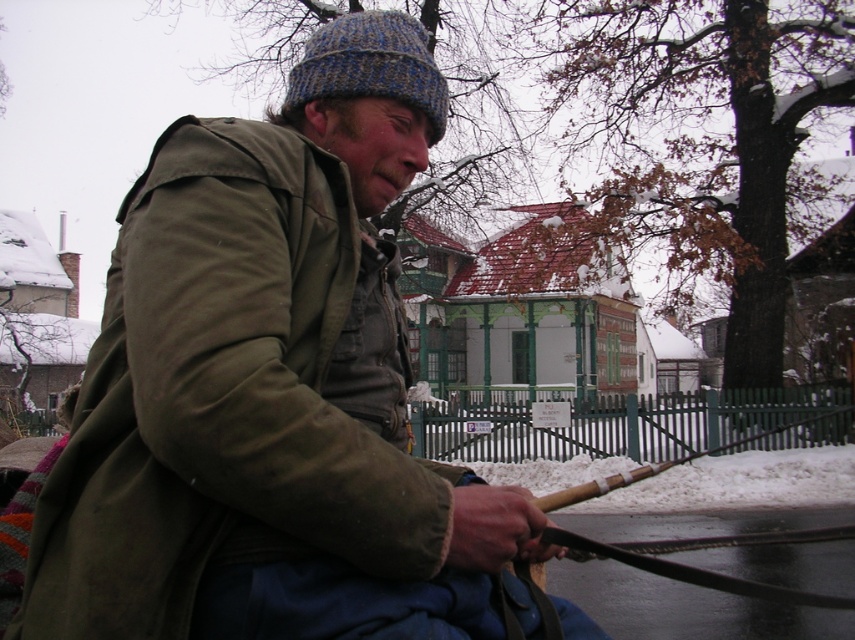
Question: Does olive green canvas jacket at center have a smaller size compared to knitted woolen hat at upper center?

Choices:
 (A) yes
 (B) no

Answer: (B)

Question: Is olive green canvas jacket at center to the left of knitted woolen hat at upper center from the viewer's perspective?

Choices:
 (A) no
 (B) yes

Answer: (B)

Question: Can you confirm if olive green canvas jacket at center is positioned below knitted woolen hat at upper center?

Choices:
 (A) no
 (B) yes

Answer: (B)

Question: Which object appears farthest from the camera in this image?

Choices:
 (A) knitted woolen hat at upper center
 (B) olive green canvas jacket at center

Answer: (A)

Question: Which point is closer to the camera?

Choices:
 (A) (286, 236)
 (B) (346, 88)

Answer: (A)

Question: Among these objects, which one is farthest from the camera?

Choices:
 (A) knitted woolen hat at upper center
 (B) olive green canvas jacket at center

Answer: (A)